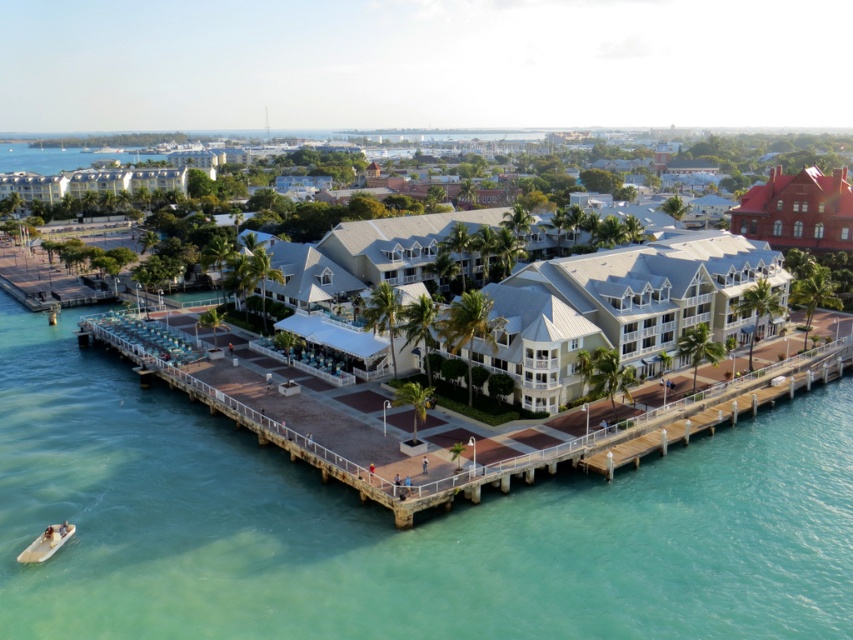
Which of these two, light beige stucco building at center or red brick building at upper right, stands shorter?

With less height is red brick building at upper right.

Is point (445, 216) closer to camera compared to point (780, 198)?

Yes, it is in front of point (780, 198).

Locate an element on the screen. This screenshot has width=853, height=640. light beige stucco building at center is located at coordinates (624, 305).

From the picture: Can you confirm if white wooden dock at lower center is smaller than red brick building at upper right?

Incorrect, white wooden dock at lower center is not smaller in size than red brick building at upper right.

Who is higher up, white wooden dock at lower center or red brick building at upper right?

red brick building at upper right

Is point (485, 472) farther from camera compared to point (790, 176)?

No, it is in front of (790, 176).

The width and height of the screenshot is (853, 640). I want to click on white wooden dock at lower center, so click(476, 465).

Is red brick building at upper right thinner than light brown wooden boat at lower left?

In fact, red brick building at upper right might be wider than light brown wooden boat at lower left.

Who is taller, red brick building at upper right or light brown wooden boat at lower left?

red brick building at upper right is taller.

Locate an element on the screen. The height and width of the screenshot is (640, 853). red brick building at upper right is located at coordinates [x=798, y=211].

This screenshot has width=853, height=640. I want to click on red brick building at upper right, so tap(798, 211).